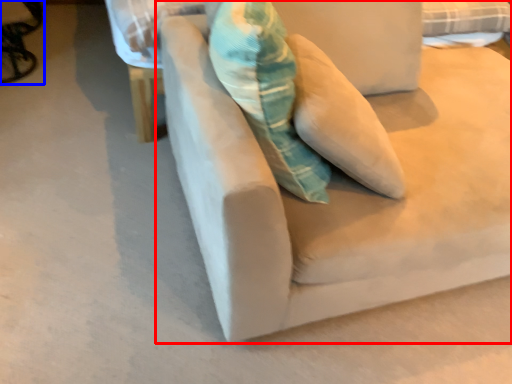
Question: Which of the following is the closest to the observer, studio couch (highlighted by a red box) or swivel chair (highlighted by a blue box)?

Choices:
 (A) studio couch
 (B) swivel chair

Answer: (A)